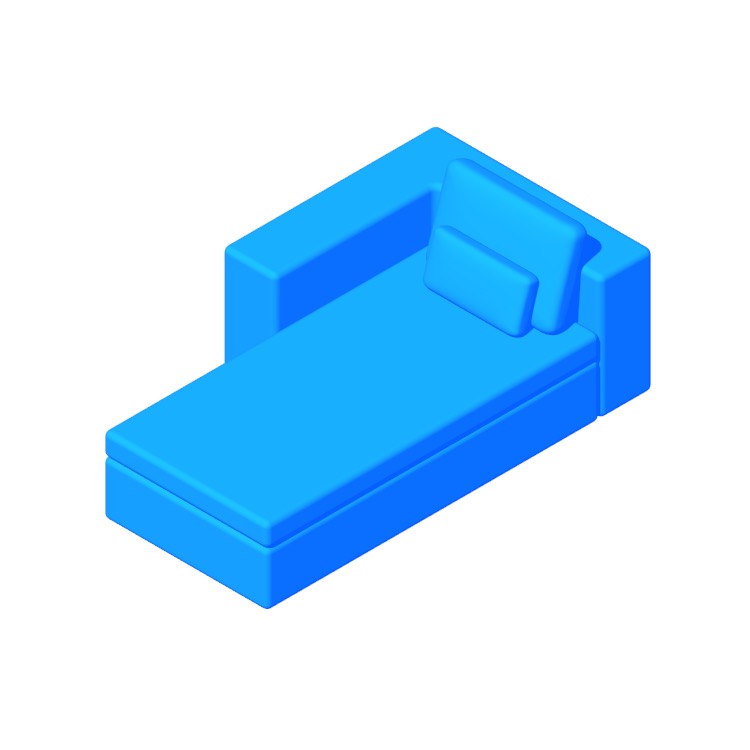
At what (x,y) coordinates should I click in order to perform the action: click on couch arm. Please return your answer as a coordinate pair (x, y). This screenshot has width=750, height=750. Looking at the image, I should click on (364, 219).